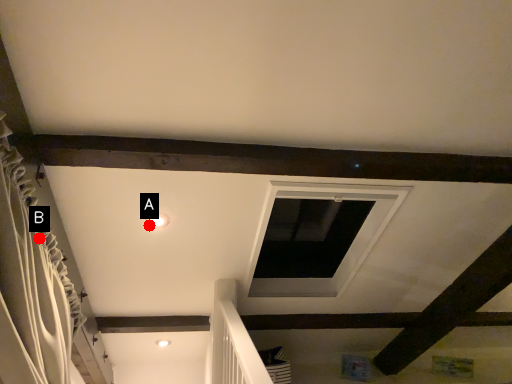
Question: Two points are circled on the image, labeled by A and B beside each circle. Among these points, which one is farthest from the camera?

Choices:
 (A) A is further
 (B) B is further

Answer: (A)